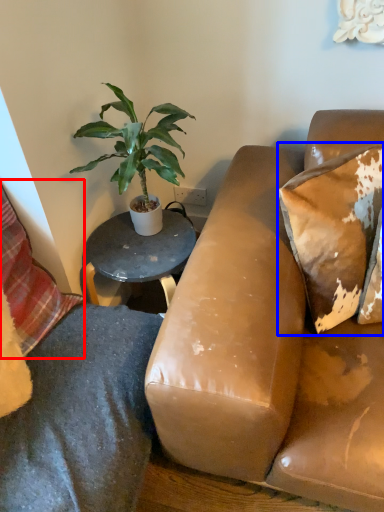
Question: Which object is closer to the camera taking this photo, pillow (highlighted by a red box) or pillow (highlighted by a blue box)?

Choices:
 (A) pillow
 (B) pillow

Answer: (A)